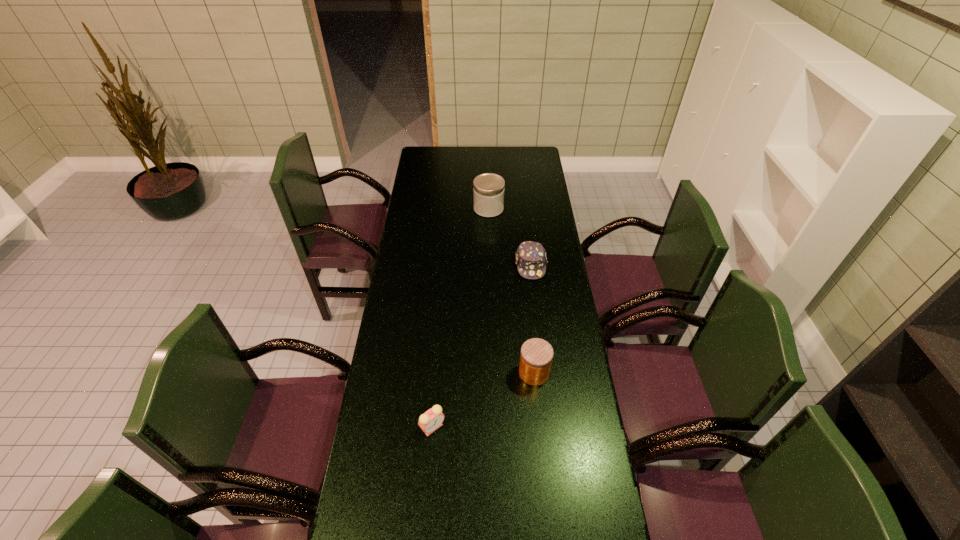
At what (x,y) coordinates should I click in order to perform the action: click on free spot between the headwear and the right jar. Please return your answer as a coordinate pair (x, y). The width and height of the screenshot is (960, 540). Looking at the image, I should click on (533, 319).

Locate an element on the screen. vacant area between the third shortest object and the headwear is located at coordinates (533, 319).

Select which object appears as the third closest to the right jar. Please provide its 2D coordinates. Your answer should be formatted as a tuple, i.e. [(x, y)], where the tuple contains the x and y coordinates of a point satisfying the conditions above.

[(488, 189)]

Identify the location of object that is the third closest to the third farthest object. (488, 189).

This screenshot has height=540, width=960. I want to click on vacant space that satisfies the following two spatial constraints: 1. on the front side of the farther jar; 2. on the left side of the right jar, so click(492, 373).